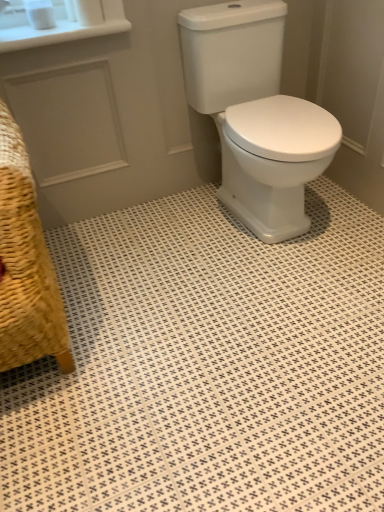
This screenshot has width=384, height=512. In order to click on vacant area situated to the left side of white glossy porcelain at center in this screenshot , I will do `click(172, 244)`.